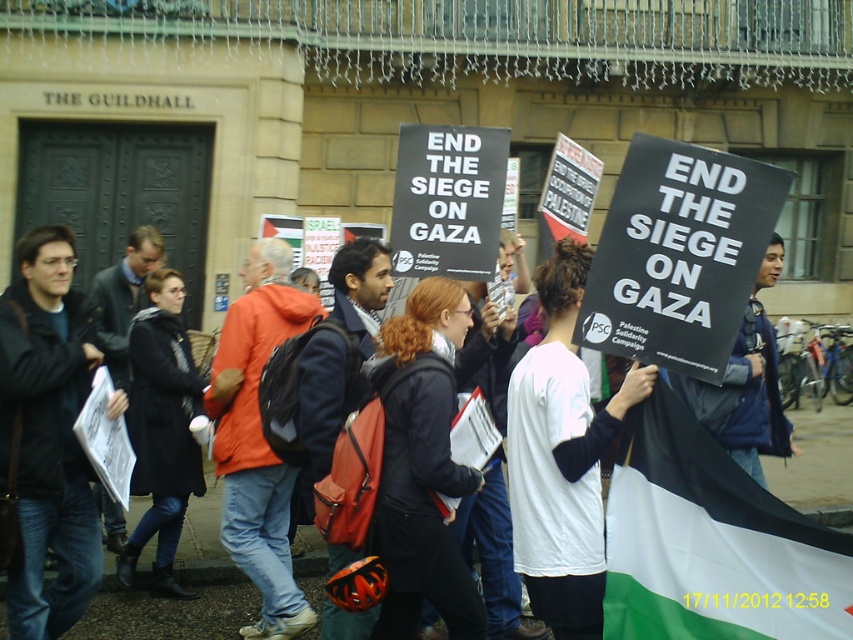
Is matte black jacket at center smaller than blue denim jacket at center?

Yes.

Who is positioned more to the right, matte black jacket at center or blue denim jacket at center?

blue denim jacket at center is more to the right.

The image size is (853, 640). Find the location of `matte black jacket at center`. matte black jacket at center is located at coordinates (47, 435).

Can you confirm if orange fabric jacket at center is positioned above blue denim jacket at center?

Yes, orange fabric jacket at center is above blue denim jacket at center.

Can you confirm if orange fabric jacket at center is shorter than blue denim jacket at center?

Correct, orange fabric jacket at center is not as tall as blue denim jacket at center.

Does point (254, 259) come farther from viewer compared to point (727, 452)?

Yes.

At what (x,y) coordinates should I click in order to perform the action: click on orange fabric jacket at center. Please return your answer as a coordinate pair (x, y). Looking at the image, I should click on (258, 436).

Does matte black jacket at center appear on the right side of orange fabric jacket at center?

Incorrect, matte black jacket at center is not on the right side of orange fabric jacket at center.

Who is positioned more to the left, matte black jacket at center or orange fabric jacket at center?

From the viewer's perspective, matte black jacket at center appears more on the left side.

This screenshot has width=853, height=640. Find the location of `matte black jacket at center`. matte black jacket at center is located at coordinates (47, 435).